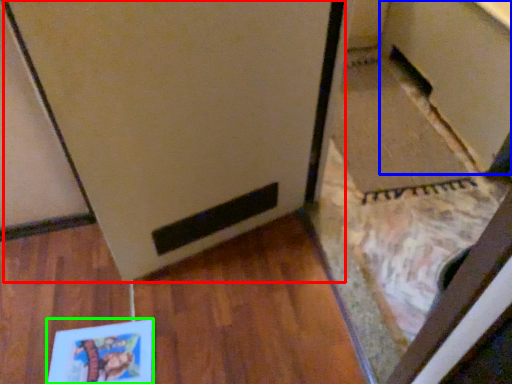
Question: Based on their relative distances, which object is nearer to fridge (highlighted by a red box)? Choose from cabinetry (highlighted by a blue box) and book (highlighted by a green box).

Choices:
 (A) cabinetry
 (B) book

Answer: (B)